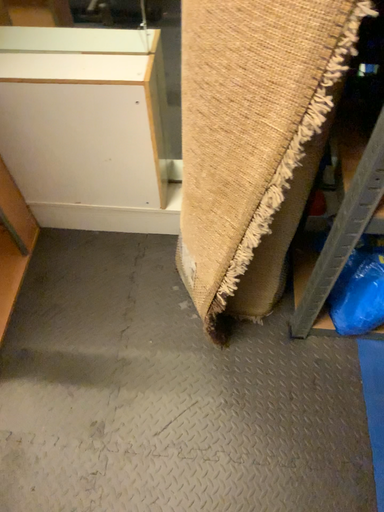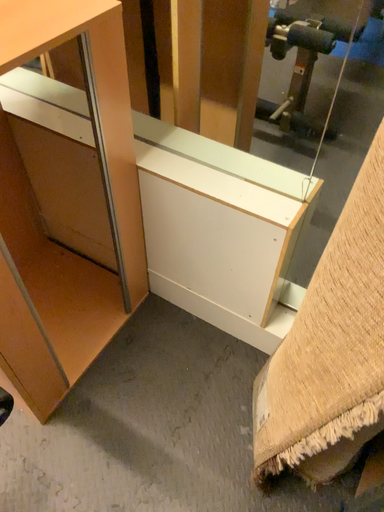
Question: Which way did the camera rotate in the video?

Choices:
 (A) rotated downward
 (B) rotated upward

Answer: (B)